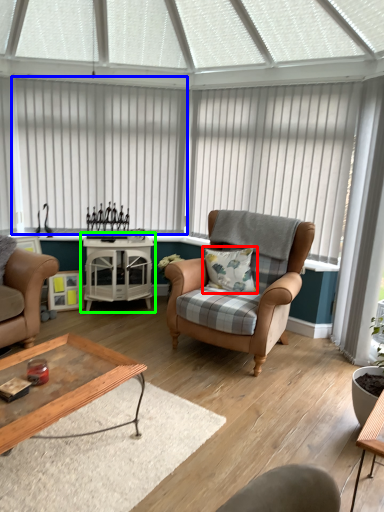
Question: Based on their relative distances, which object is farther from pillow (highlighted by a red box)? Choose from blind (highlighted by a blue box) and table (highlighted by a green box).

Choices:
 (A) blind
 (B) table

Answer: (A)